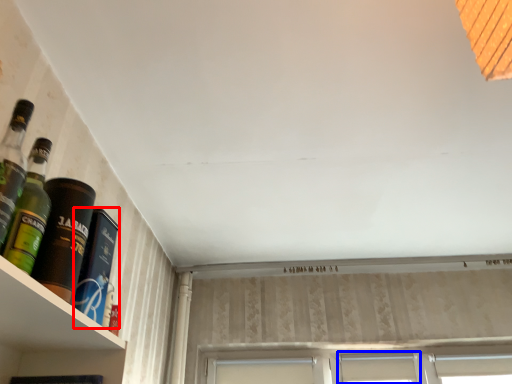
Question: Among these objects, which one is farthest to the camera, bottle (highlighted by a red box) or window (highlighted by a blue box)?

Choices:
 (A) bottle
 (B) window

Answer: (B)